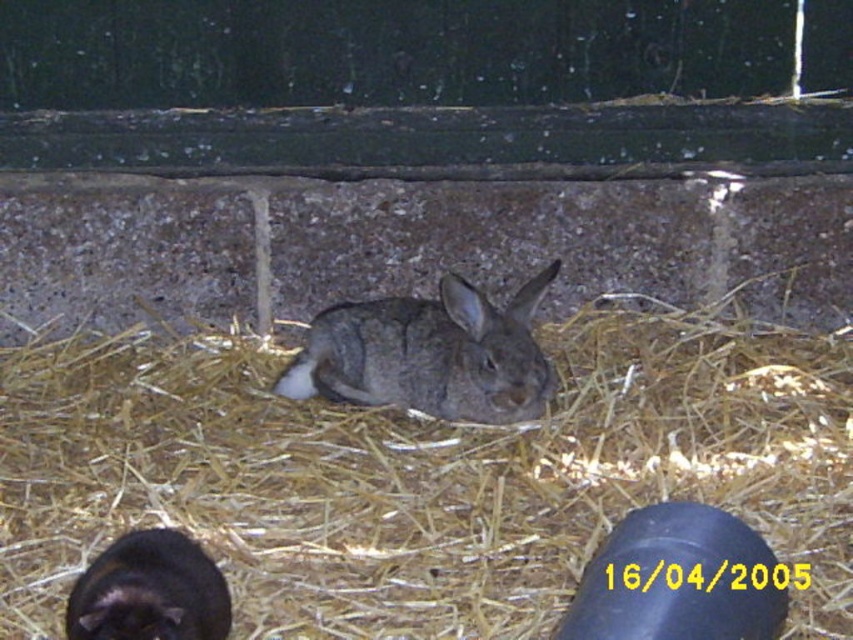
Question: Is brown straw at center positioned in front of fuzzy gray rabbit at center?

Choices:
 (A) yes
 (B) no

Answer: (A)

Question: Can you confirm if fuzzy gray rabbit at center is thinner than black fur rabbit at lower left?

Choices:
 (A) yes
 (B) no

Answer: (B)

Question: Which point is closer to the camera taking this photo?

Choices:
 (A) (527, 492)
 (B) (550, 381)
 (C) (108, 557)

Answer: (C)

Question: Among these points, which one is nearest to the camera?

Choices:
 (A) (416, 449)
 (B) (526, 314)
 (C) (117, 637)

Answer: (C)

Question: Among these points, which one is nearest to the camera?

Choices:
 (A) (357, 397)
 (B) (383, 480)

Answer: (B)

Question: In this image, where is brown straw at center located relative to fuzzy gray rabbit at center?

Choices:
 (A) below
 (B) above

Answer: (A)